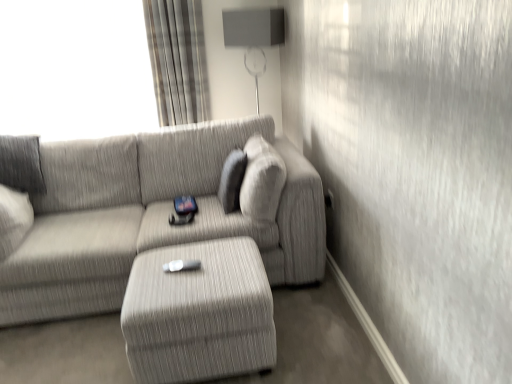
Question: Can you confirm if matte gray lampshade at upper center is smaller than plaid fabric curtain at upper left?

Choices:
 (A) yes
 (B) no

Answer: (B)

Question: Is matte gray lampshade at upper center next to plaid fabric curtain at upper left?

Choices:
 (A) no
 (B) yes

Answer: (A)

Question: Would you say plaid fabric curtain at upper left is part of matte gray lampshade at upper center's contents?

Choices:
 (A) no
 (B) yes

Answer: (A)

Question: Is matte gray lampshade at upper center far from plaid fabric curtain at upper left?

Choices:
 (A) yes
 (B) no

Answer: (B)

Question: Is matte gray lampshade at upper center bigger than plaid fabric curtain at upper left?

Choices:
 (A) yes
 (B) no

Answer: (A)

Question: Is matte gray lampshade at upper center positioned before plaid fabric curtain at upper left?

Choices:
 (A) yes
 (B) no

Answer: (A)

Question: Does plaid fabric curtain at upper left have a greater height compared to white matte wii controller at center?

Choices:
 (A) yes
 (B) no

Answer: (A)

Question: From a real-world perspective, is plaid fabric curtain at upper left positioned under white matte wii controller at center based on gravity?

Choices:
 (A) yes
 (B) no

Answer: (B)

Question: Is plaid fabric curtain at upper left to the right of white matte wii controller at center from the viewer's perspective?

Choices:
 (A) yes
 (B) no

Answer: (B)

Question: Is plaid fabric curtain at upper left not inside white matte wii controller at center?

Choices:
 (A) no
 (B) yes

Answer: (B)

Question: Is plaid fabric curtain at upper left wider than white matte wii controller at center?

Choices:
 (A) yes
 (B) no

Answer: (A)

Question: Is plaid fabric curtain at upper left far away from white matte wii controller at center?

Choices:
 (A) no
 (B) yes

Answer: (B)

Question: Is plaid fabric curtain at upper left bigger than matte gray lampshade at upper center?

Choices:
 (A) yes
 (B) no

Answer: (B)